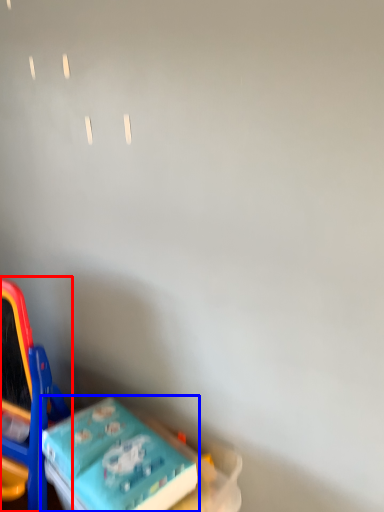
Question: Among these objects, which one is farthest to the camera, toy (highlighted by a red box) or toy (highlighted by a blue box)?

Choices:
 (A) toy
 (B) toy

Answer: (A)